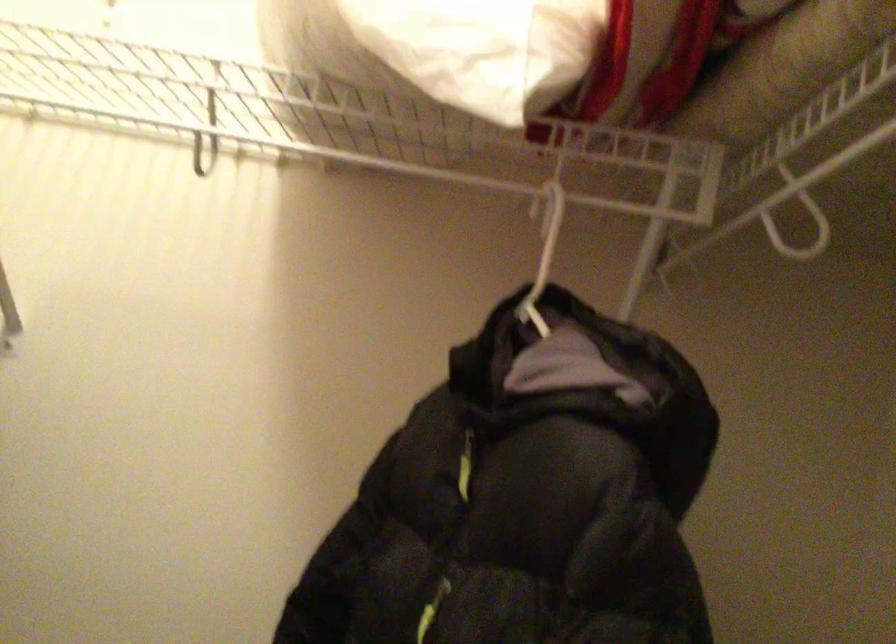
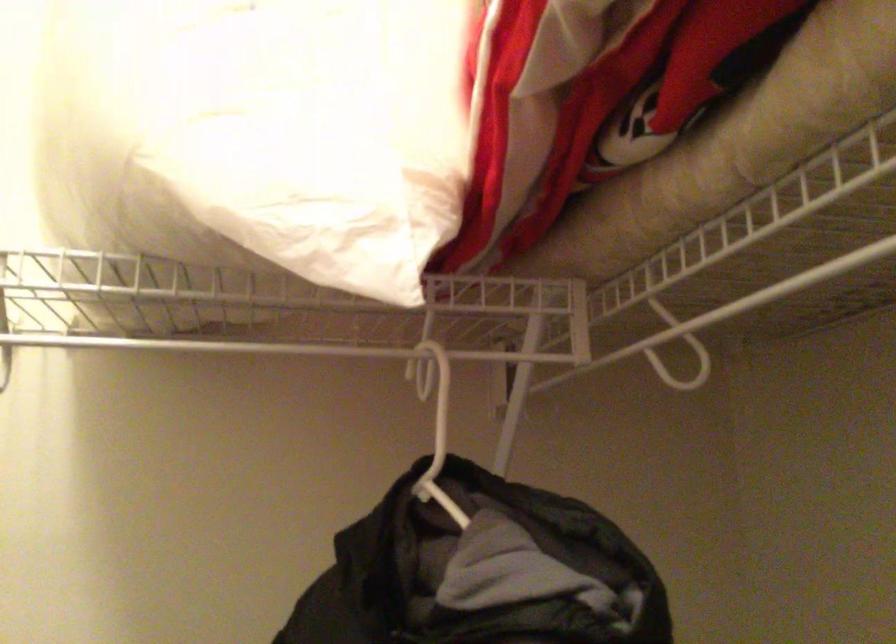
Question: The images are taken continuously from a first-person perspective. In which direction is your viewpoint rotating?

Choices:
 (A) Left
 (B) Right
 (C) Up
 (D) Down

Answer: (B)